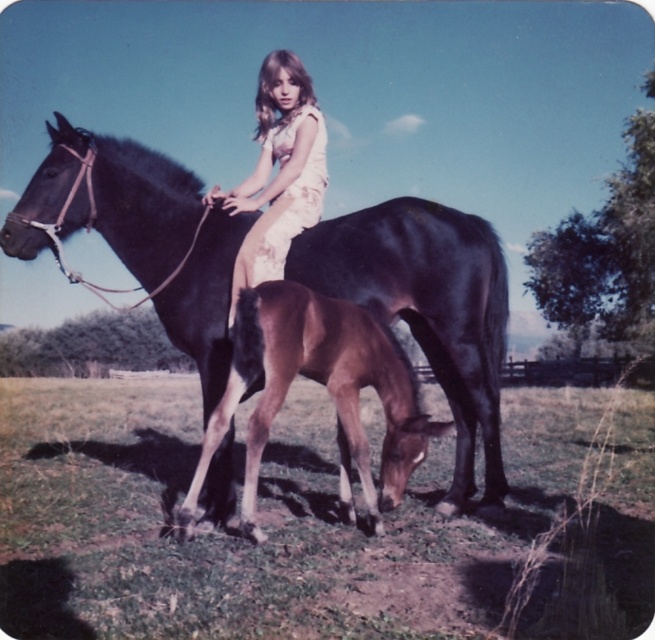
Does shiny dark brown horse at center appear on the right side of matte floral dress at center?

Yes, shiny dark brown horse at center is to the right of matte floral dress at center.

Can you confirm if shiny dark brown horse at center is positioned to the left of matte floral dress at center?

Incorrect, shiny dark brown horse at center is not on the left side of matte floral dress at center.

Describe the element at coordinates (426, 307) in the screenshot. The height and width of the screenshot is (640, 655). I see `shiny dark brown horse at center` at that location.

The height and width of the screenshot is (640, 655). I want to click on shiny dark brown horse at center, so click(x=426, y=307).